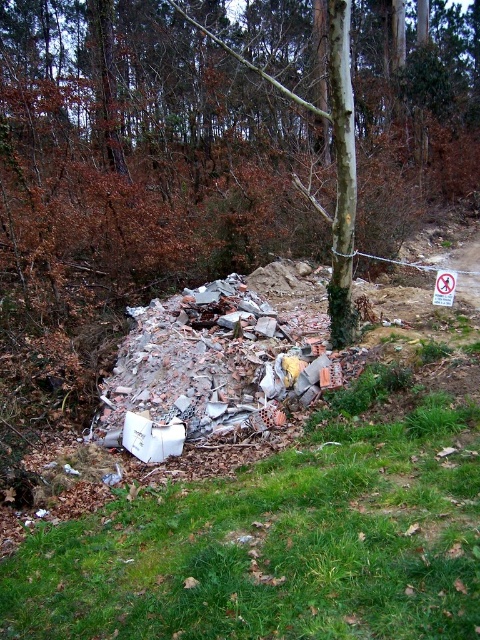
Who is more distant from viewer, (20, 26) or (388, 552)?

The point (20, 26) is more distant.

Identify the location of green bark tree at center. (154, 140).